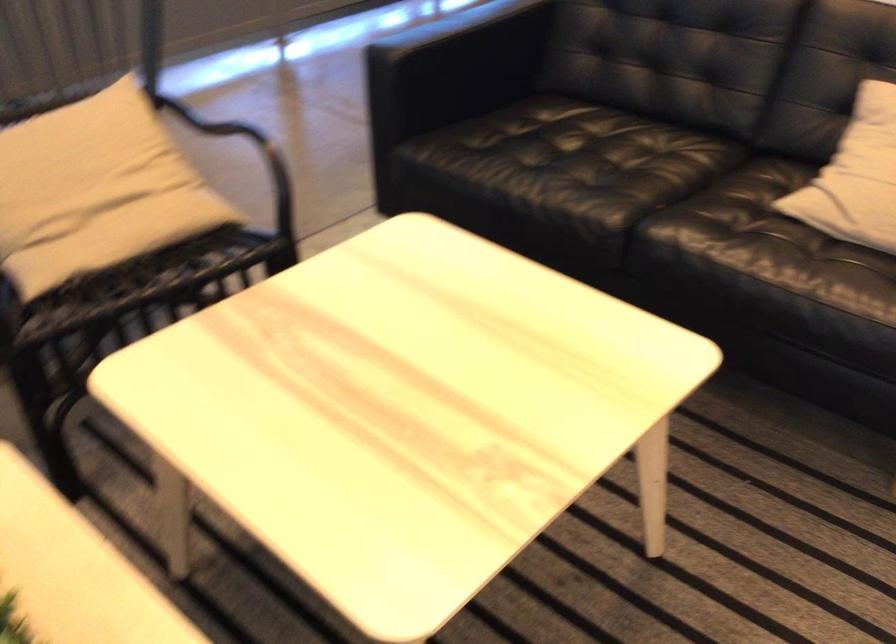
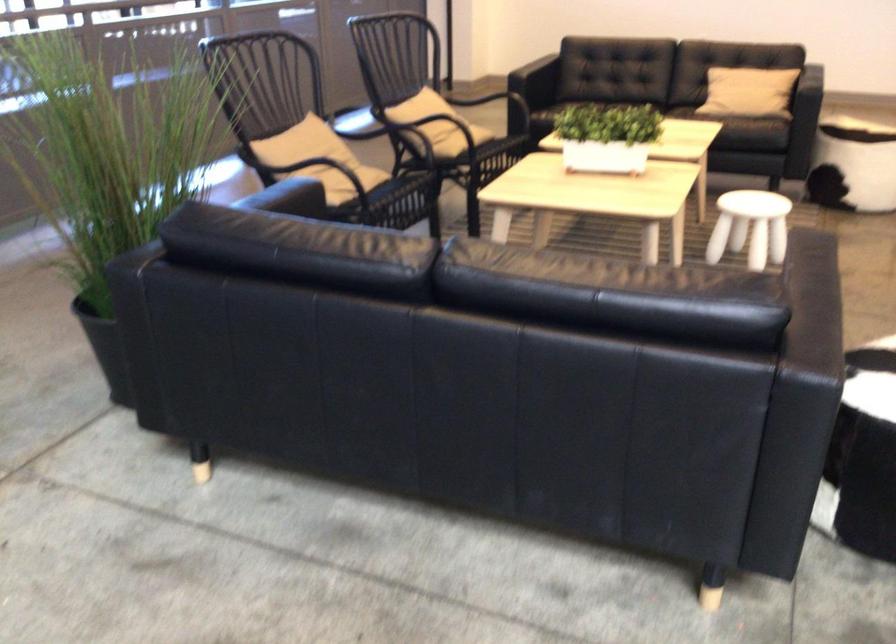
The point at (772, 317) is marked in the first image. Where is the corresponding point in the second image?

(745, 120)